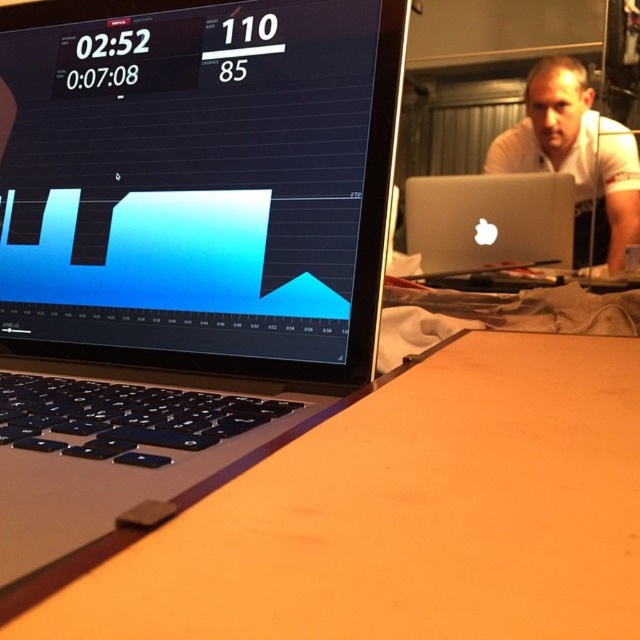
Is matte black laptop at center positioned behind wooden table at center?

Yes, it is.

Is point (44, 200) positioned before point (419, 618)?

That is False.

You are a GUI agent. You are given a task and a screenshot of the screen. Output one action in this format:
    pyautogui.click(x=<x>, y=<y>)
    Task: Click on the matte black laptop at center
    The image size is (640, 640).
    Given the screenshot: What is the action you would take?
    pyautogui.click(x=198, y=180)

Can you confirm if matte black laptop at center is wider than white smooth shirt at upper right?

Yes, matte black laptop at center is wider than white smooth shirt at upper right.

Is matte black laptop at center closer to the viewer compared to white smooth shirt at upper right?

That is True.

Does point (154, 346) lie behind point (620, 128)?

No, (154, 346) is in front of (620, 128).

Locate an element on the screen. matte black laptop at center is located at coordinates (198, 180).

Between wooden table at center and silver metallic laptop at center, which one appears on the left side from the viewer's perspective?

From the viewer's perspective, wooden table at center appears more on the left side.

How far apart are wooden table at center and silver metallic laptop at center?

wooden table at center is 36.75 inches from silver metallic laptop at center.

Locate an element on the screen. The image size is (640, 640). wooden table at center is located at coordinates (406, 515).

The image size is (640, 640). Identify the location of wooden table at center. (406, 515).